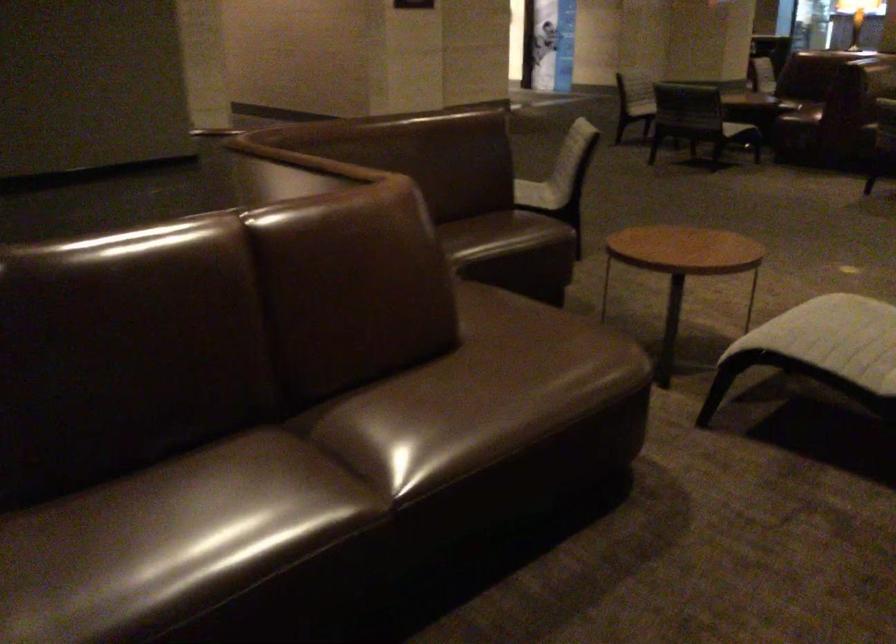
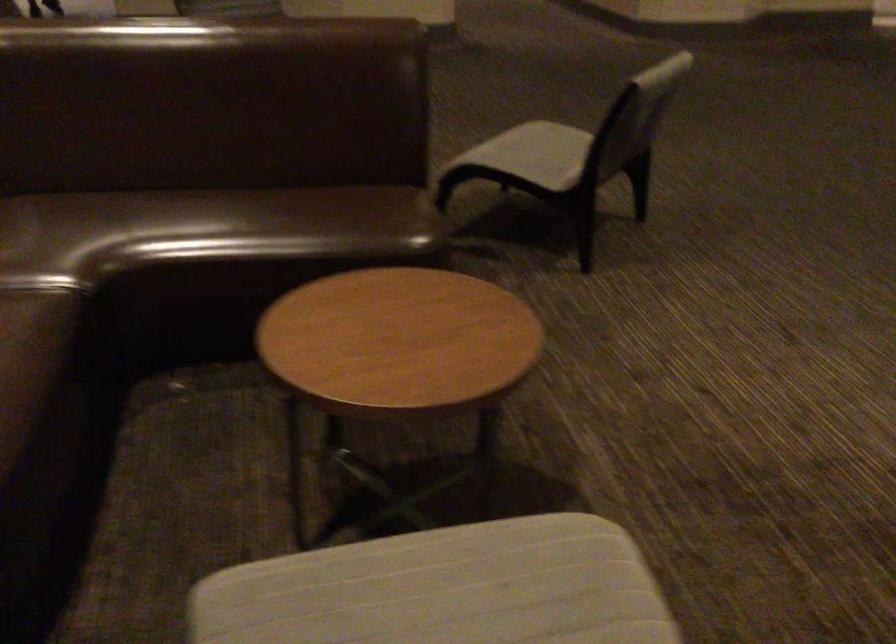
Find the pixel in the second image that matches (x=824, y=314) in the first image.

(444, 589)